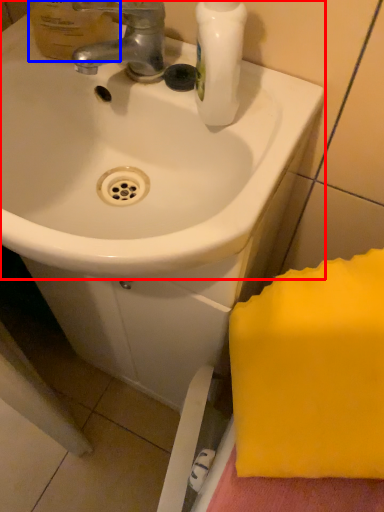
Question: Which of the following is the closest to the observer, sink (highlighted by a red box) or mouthwash (highlighted by a blue box)?

Choices:
 (A) sink
 (B) mouthwash

Answer: (A)